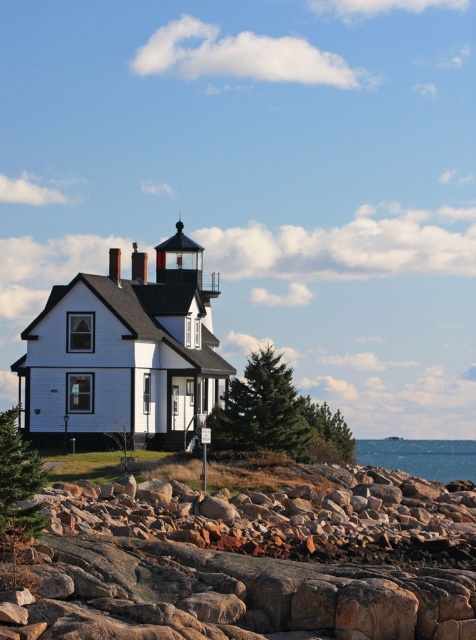
Question: Which point is farther to the camera?

Choices:
 (A) rockyrough texturedrocks at lower right
 (B) blue water at lower right

Answer: (B)

Question: Is the position of rockyrough texturedrocks at lower right more distant than that of blue water at lower right?

Choices:
 (A) no
 (B) yes

Answer: (A)

Question: Among these objects, which one is farthest from the camera?

Choices:
 (A) rockyrough texturedrocks at lower right
 (B) blue water at lower right

Answer: (B)

Question: Which point is farther to the camera?

Choices:
 (A) (413, 442)
 (B) (410, 566)

Answer: (A)

Question: In this image, where is rockyrough texturedrocks at lower right located relative to blue water at lower right?

Choices:
 (A) below
 (B) above

Answer: (B)

Question: Can you confirm if rockyrough texturedrocks at lower right is wider than blue water at lower right?

Choices:
 (A) no
 (B) yes

Answer: (A)